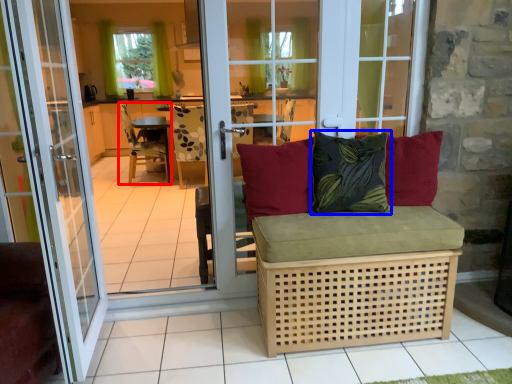
Question: Which point is closer to the camera, chair (highlighted by a red box) or pillow (highlighted by a blue box)?

Choices:
 (A) chair
 (B) pillow

Answer: (B)